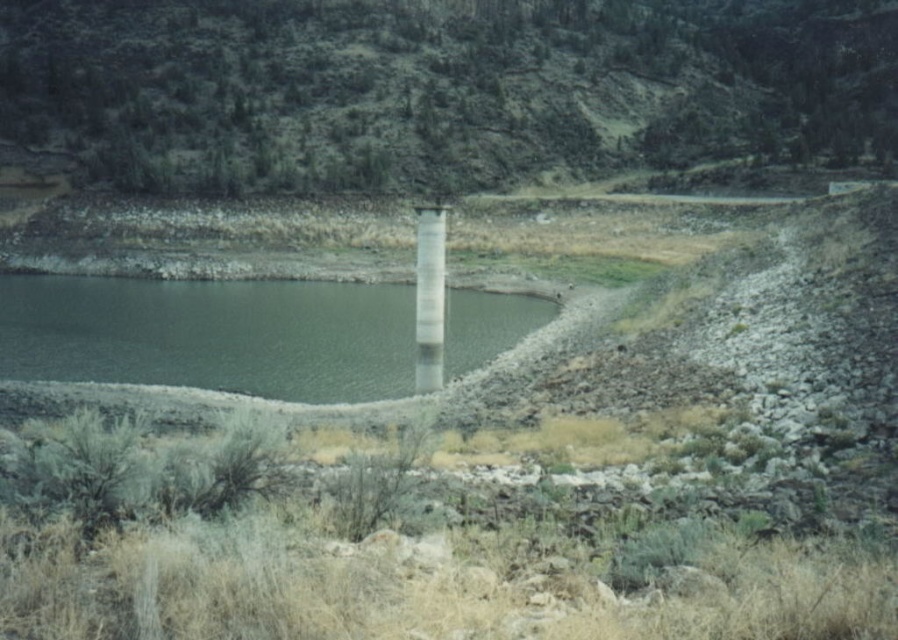
You are a hiker who wants to take a photo of the white glossy pillar at center from the green grassy hillside at upper center. Is the pillar visible from the hillside?

The green grassy hillside at upper center is located above the white glossy pillar at center, so the pillar is visible from the hillside.

You are a hiker trying to navigate from the green grassy hillside at upper center to the green concrete water at center left. Which direction should you move to reach your destination?

You should move to the left to reach the green concrete water at center left from the green grassy hillside at upper center because the hillside is to the right of the water.